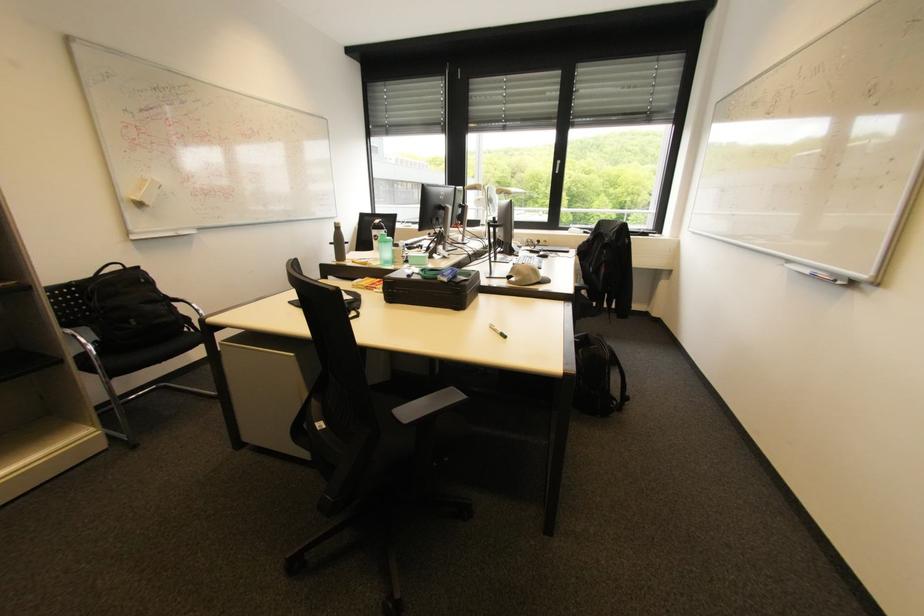
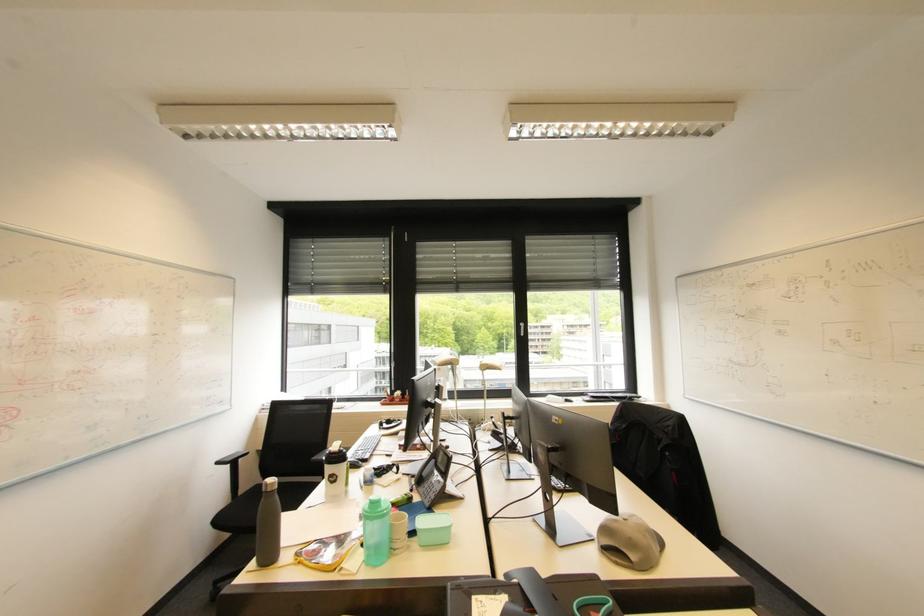
In a continuous first-person perspective shot, in which direction is the camera moving?

The cameraman moved toward left, forward.